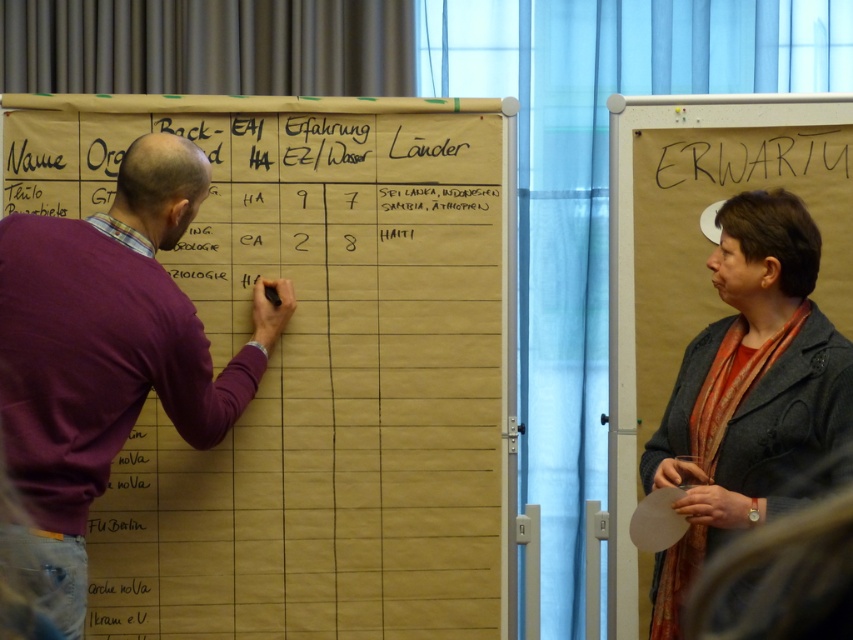
You are organizing a clothing donation drive and need to determine which items can fit into a standard donation box. The purple sweater at left and the gray woolen jacket at right are both candidates. Based on their sizes, which one is more likely to fit into the box?

The gray woolen jacket at right is more likely to fit into the standard donation box since it is smaller than the purple sweater at left.

You are an observer standing in front of the flip charts. You notice two people participating in the activity. One is wearing a purple sweater at left and the other has a gray woolen jacket at right. Based on their positions relative to each other, which person is closer to the top of the flip chart?

The purple sweater at left is located above the gray woolen jacket at right, so the person in the purple sweater at left is closer to the top of the flip chart.